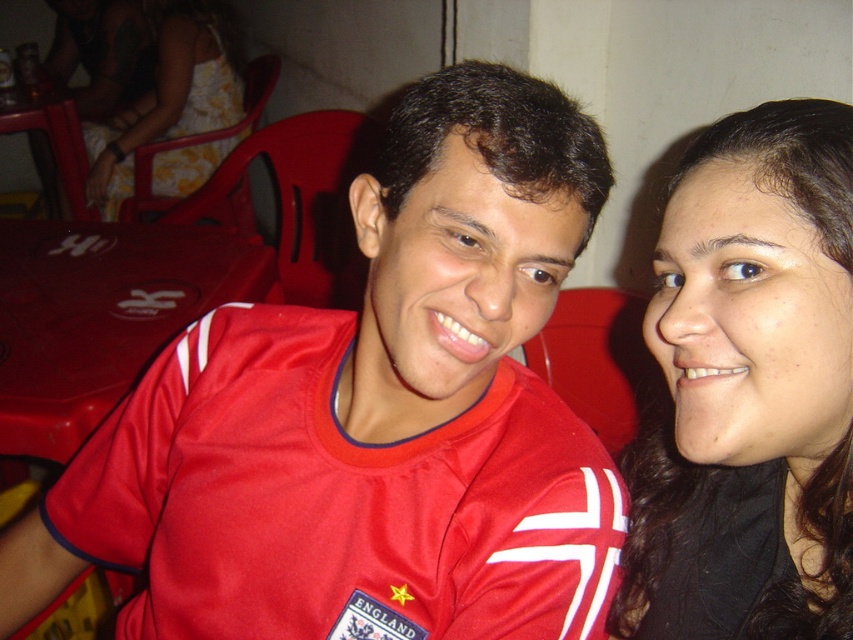
Question: Where is matte red jersey at center located in relation to yellow floral dress at upper left in the image?

Choices:
 (A) left
 (B) right

Answer: (B)

Question: Is matte red jersey at center wider than black matte hair at upper right?

Choices:
 (A) no
 (B) yes

Answer: (B)

Question: Estimate the real-world distances between objects in this image. Which object is farther from the yellow floral dress at upper left?

Choices:
 (A) black matte hair at upper right
 (B) matte red jersey at center

Answer: (A)

Question: Which point is farther from the camera taking this photo?

Choices:
 (A) (699, 209)
 (B) (212, 68)

Answer: (B)

Question: Can you confirm if matte red jersey at center is wider than black matte hair at upper right?

Choices:
 (A) no
 (B) yes

Answer: (B)

Question: Which object appears farthest from the camera in this image?

Choices:
 (A) black matte hair at upper right
 (B) matte red jersey at center

Answer: (B)